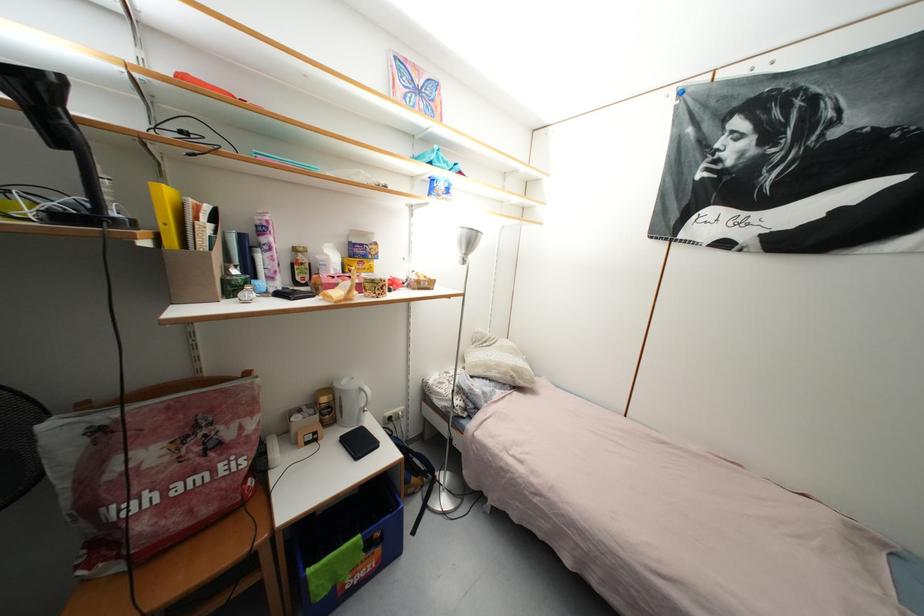
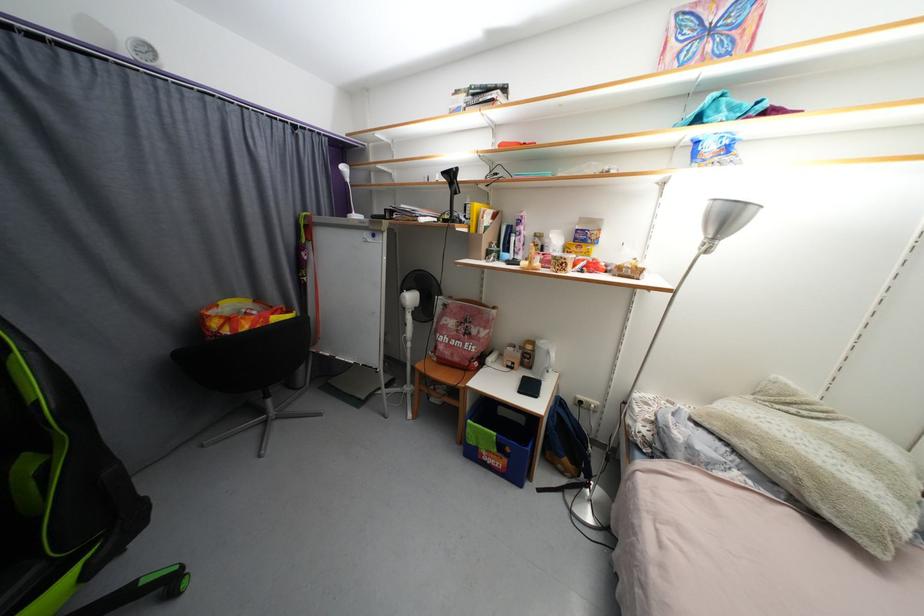
In the second image, find the point that corresponds to pixel 419 496 in the first image.

(567, 475)